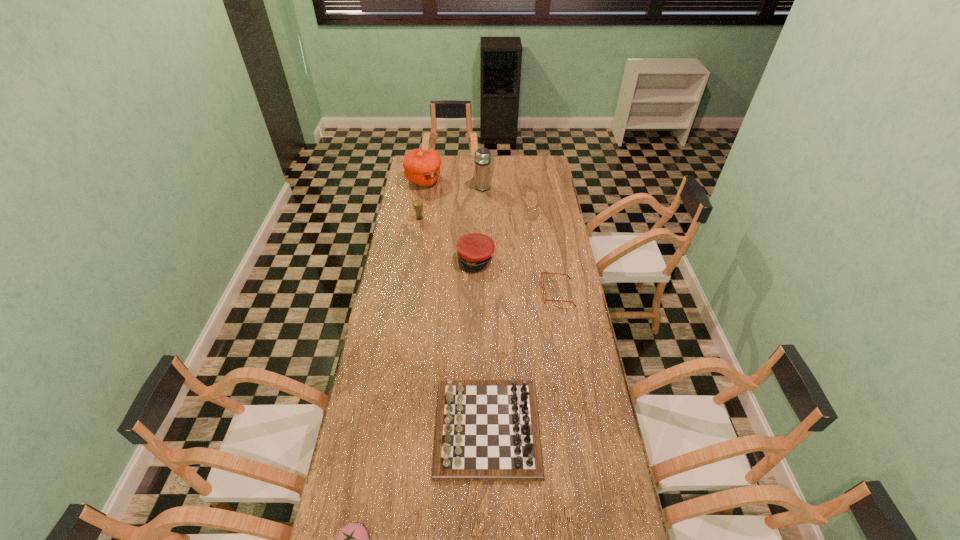
Where is `thermos bottle`? thermos bottle is located at coordinates (482, 155).

Image resolution: width=960 pixels, height=540 pixels. In order to click on the sixth shortest object in this screenshot , I will do `click(422, 167)`.

In order to click on straw for drinking in this screenshot , I will do `click(417, 204)`.

This screenshot has width=960, height=540. What are the coordinates of `the third farthest object` in the screenshot? It's located at (417, 204).

Find the location of `the fourth nearest object`. the fourth nearest object is located at coordinates (474, 250).

Find the location of `chessboard`. chessboard is located at coordinates (486, 430).

This screenshot has width=960, height=540. Identify the location of spectacles. coord(542,272).

This screenshot has height=540, width=960. What are the coordinates of `the shortest object` in the screenshot? It's located at (542, 272).

Identify the location of vacant region located 0.260m with a handle on the side of the thermos bottle. (482, 158).

What are the coordinates of `free space located 0.180m with a handle on the side of the thermos bottle` in the screenshot? It's located at 483,165.